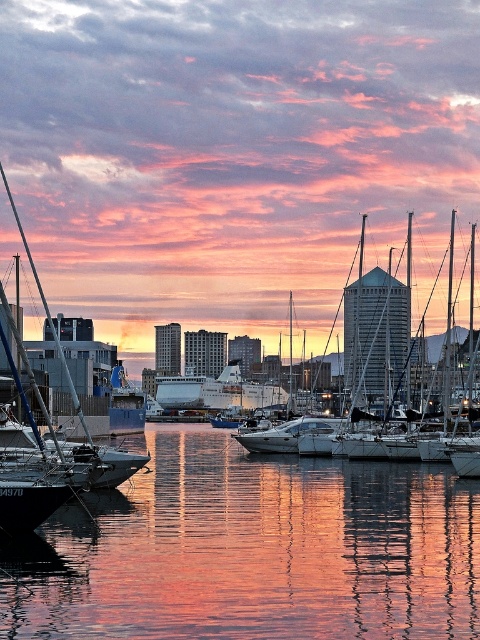
Question: Considering the real-world distances, which object is closest to the white glossy sailboat at center?

Choices:
 (A) reflective glass water at center
 (B) white glossy cruise ship at center

Answer: (B)

Question: Does reflective glass water at center appear over white glossy cruise ship at center?

Choices:
 (A) yes
 (B) no

Answer: (A)

Question: Can you confirm if reflective glass water at center is positioned to the left of white glossy cruise ship at center?

Choices:
 (A) yes
 (B) no

Answer: (B)

Question: Estimate the real-world distances between objects in this image. Which object is closer to the reflective glass water at center?

Choices:
 (A) white glossy sailboat at center
 (B) white glossy cruise ship at center

Answer: (A)

Question: Is reflective glass water at center closer to camera compared to white glossy sailboat at center?

Choices:
 (A) yes
 (B) no

Answer: (A)

Question: Based on their relative distances, which object is nearer to the reflective glass water at center?

Choices:
 (A) white glossy sailboat at center
 (B) white glossy cruise ship at center

Answer: (A)